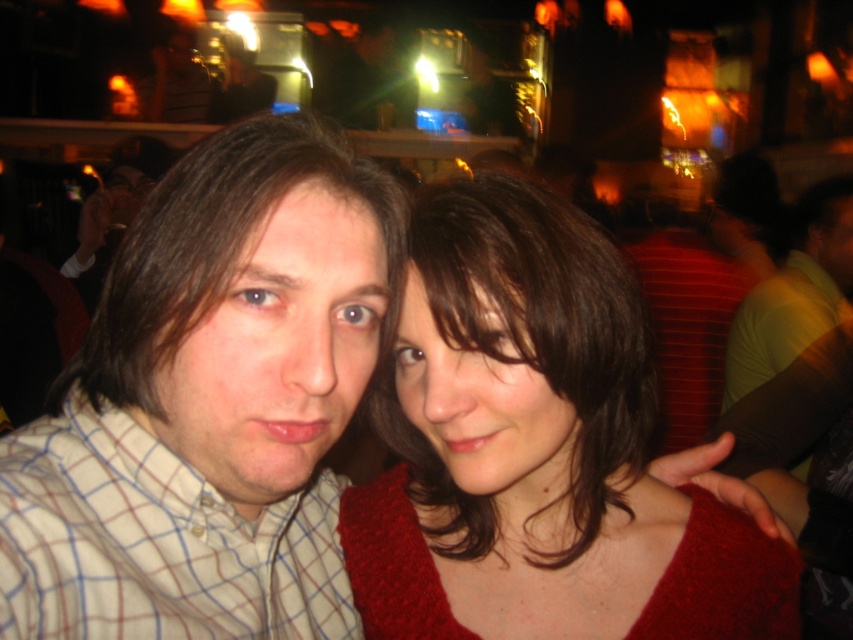
You are a photographer trying to focus on the plaid shirt at center in the image. The camera has a focus point at coordinates point (210, 403). Is the focus point correctly placed to capture the plaid shirt at center?

Yes, the focus point at point (210, 403) is correctly placed to capture the plaid shirt at center as the description states that the point indicates the plaid shirt at center.

You are a photographer trying to frame two subjects wearing a plaid shirt at center and a matte red sweater at center. Since you want to ensure both are visible in the shot, which subject should you position closer to the camera to maintain their sizes in the photo?

The plaid shirt at center has a lesser width compared to the matte red sweater at center, so you should position the plaid shirt at center closer to the camera to ensure both appear similarly sized in the photo.

You are a photographer adjusting your camera settings to focus on both the matte red sweater at center and the plaid cotton shirt at left. Which object should you focus on first to ensure both are in sharp focus?

The matte red sweater at center is closer to the viewer than the plaid cotton shirt at left, so focus on the matte red sweater at center first to ensure both are in sharp focus.